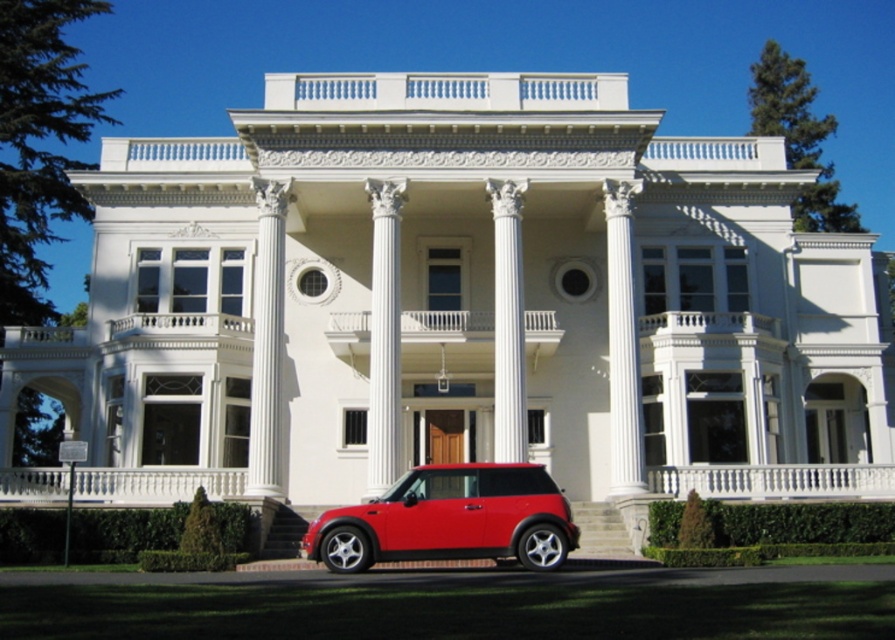
Is glossy red car at lower center shorter than white marble column at center?

Indeed, glossy red car at lower center has a lesser height compared to white marble column at center.

In the scene shown: Can you confirm if glossy red car at lower center is positioned above white marble column at center?

Incorrect, glossy red car at lower center is not positioned above white marble column at center.

This screenshot has width=895, height=640. In order to click on glossy red car at lower center in this screenshot , I will do [x=450, y=518].

Is glossy red car at lower center in front of white glossy column at center?

Yes, glossy red car at lower center is in front of white glossy column at center.

Does glossy red car at lower center have a lesser width compared to white glossy column at center?

Incorrect, glossy red car at lower center's width is not less than white glossy column at center's.

Which is behind, point (344, 570) or point (512, 432)?

The point (512, 432) is more distant.

Locate an element on the screen. glossy red car at lower center is located at coordinates (450, 518).

Does white marble column at center have a smaller size compared to white glossy column at center?

No, white marble column at center is not smaller than white glossy column at center.

Is point (397, 289) more distant than point (510, 429)?

Yes, it is.

This screenshot has width=895, height=640. In order to click on white marble column at center in this screenshot , I will do `click(384, 336)`.